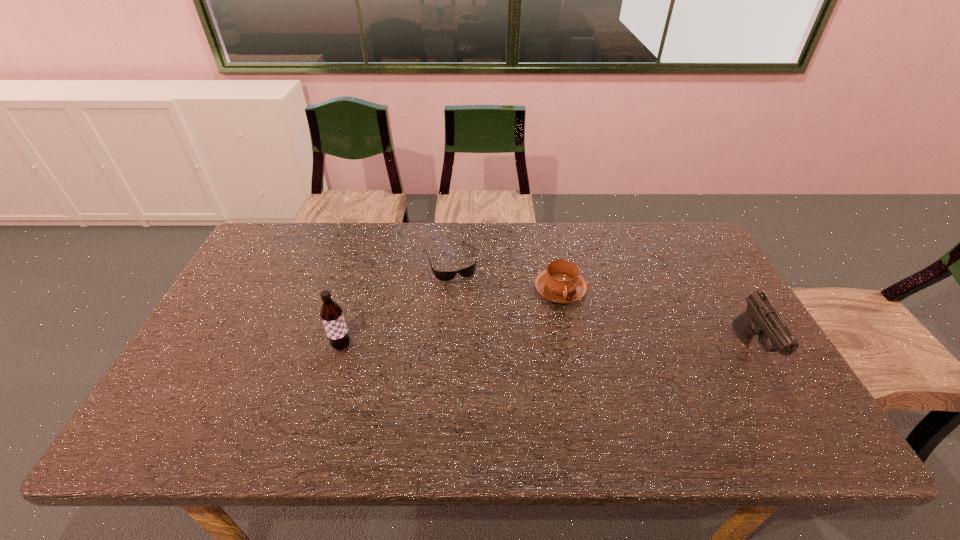
At what (x,y) coordinates should I click in order to perform the action: click on blank area located on the side of the third object from left to right with the handle. Please return your answer as a coordinate pair (x, y). The image size is (960, 540). Looking at the image, I should click on (610, 359).

Where is `vacant area situated on the side of the third object from left to right with the handle`? The image size is (960, 540). vacant area situated on the side of the third object from left to right with the handle is located at coordinates (588, 328).

Identify the location of free spot located 0.060m on the side of the third object from left to right with the handle. The width and height of the screenshot is (960, 540). (584, 323).

I want to click on vacant area located on the front-facing side of the second object from left to right, so click(x=492, y=362).

The width and height of the screenshot is (960, 540). In order to click on free spot located on the front-facing side of the second object from left to right in this screenshot , I will do `click(476, 325)`.

Locate an element on the screen. The width and height of the screenshot is (960, 540). vacant space located 0.240m on the front-facing side of the second object from left to right is located at coordinates (482, 339).

What are the coordinates of `object positioned at the far edge` in the screenshot? It's located at (440, 275).

This screenshot has width=960, height=540. Find the location of `object that is at the near edge`. object that is at the near edge is located at coordinates (760, 318).

Locate an element on the screen. object located in the right edge section of the desktop is located at coordinates tap(760, 318).

Where is `object at the near right corner`? The image size is (960, 540). object at the near right corner is located at coordinates (760, 318).